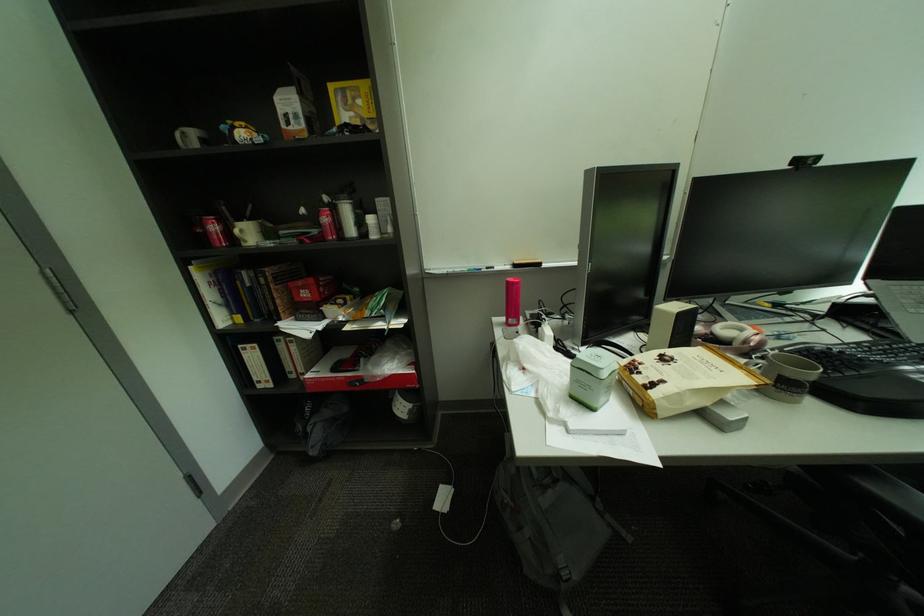
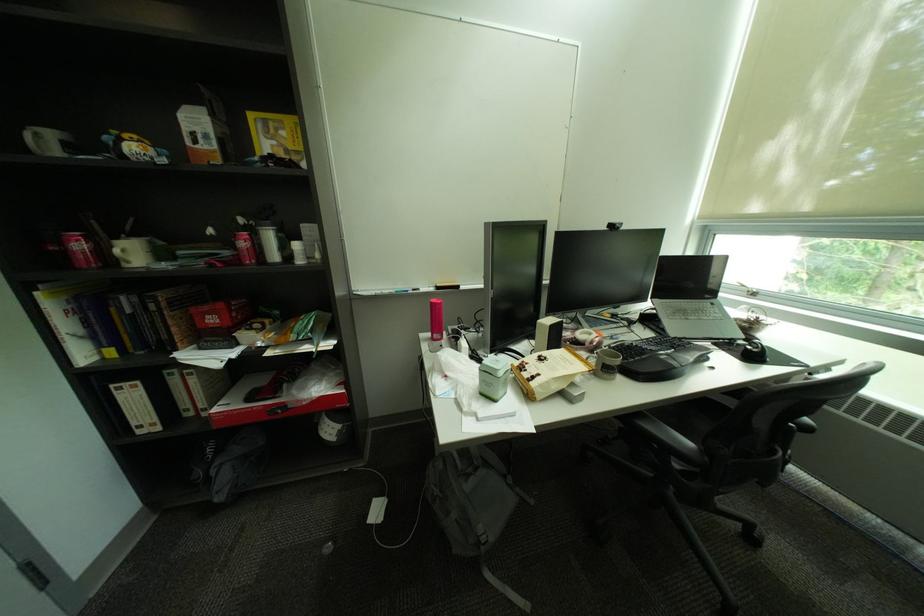
In the second image, find the point that corresponds to the point at 784,387 in the first image.

(613, 371)